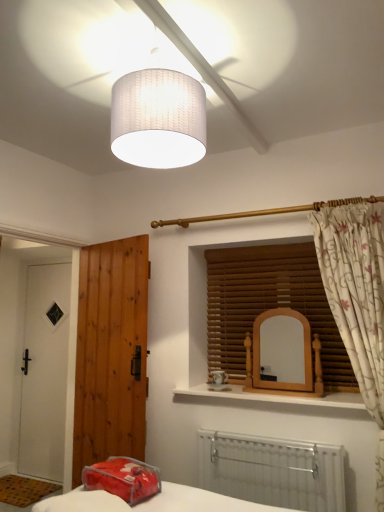
The image size is (384, 512). In order to click on free space above white textured lampshade at upper center (from a real-world perspective) in this screenshot , I will do `click(167, 44)`.